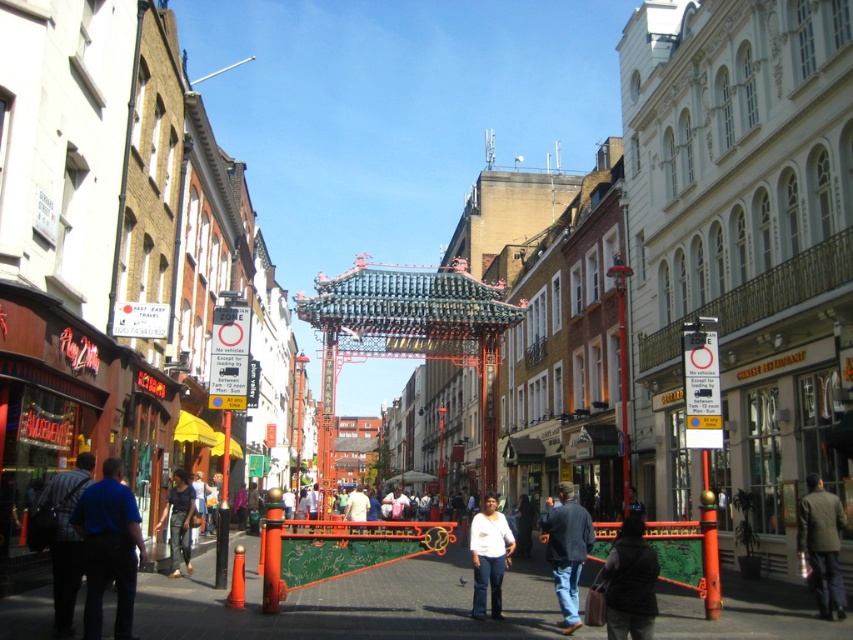
Can you confirm if blue shirt at lower left is positioned below dark blue shirt at center?

No.

What do you see at coordinates (109, 548) in the screenshot? I see `blue shirt at lower left` at bounding box center [109, 548].

Who is more forward, (105, 531) or (175, 529)?

Point (105, 531) is more forward.

The image size is (853, 640). I want to click on blue shirt at lower left, so click(x=109, y=548).

Can you confirm if dark brown jacket at lower right is bigger than dark blue shirt at center?

Actually, dark brown jacket at lower right might be smaller than dark blue shirt at center.

Find the location of a particular element. dark brown jacket at lower right is located at coordinates (822, 545).

Find the location of `dark brown jacket at lower right`. dark brown jacket at lower right is located at coordinates (822, 545).

Which is in front, point (45, 522) or point (563, 609)?

Point (45, 522) is in front.

Does point (67, 632) lie in front of point (566, 500)?

That is True.

Identify the location of dark blue shirt at lower left. The width and height of the screenshot is (853, 640). (65, 538).